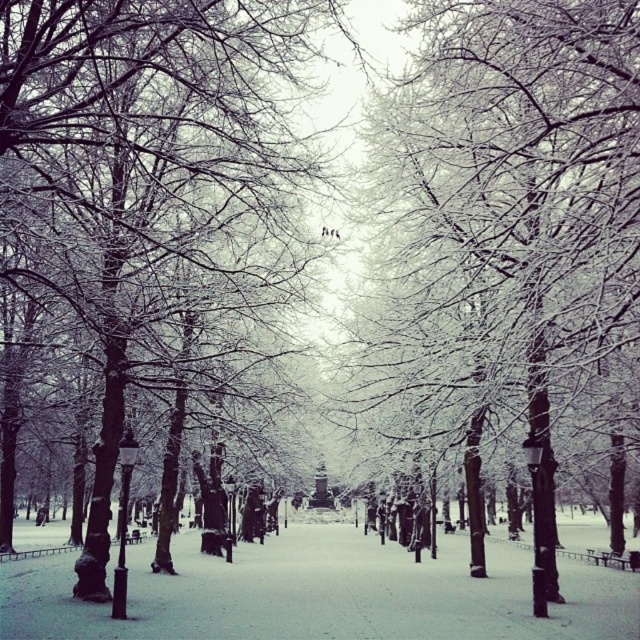
Question: Which point is closer to the camera?

Choices:
 (A) white frosty tree at center
 (B) white frosty branches at center

Answer: (A)

Question: Is the position of white frosty branches at center more distant than that of white frosty tree at center?

Choices:
 (A) yes
 (B) no

Answer: (A)

Question: Considering the relative positions of white frosty branches at center and white frosty tree at center in the image provided, where is white frosty branches at center located with respect to white frosty tree at center?

Choices:
 (A) right
 (B) left

Answer: (A)

Question: Can you confirm if white frosty branches at center is positioned above white frosty tree at center?

Choices:
 (A) no
 (B) yes

Answer: (B)

Question: Which point is farther to the camera?

Choices:
 (A) white frosty branches at center
 (B) white frosty tree at center

Answer: (A)

Question: Which point is closer to the camera taking this photo?

Choices:
 (A) (579, 193)
 (B) (172, 252)

Answer: (A)